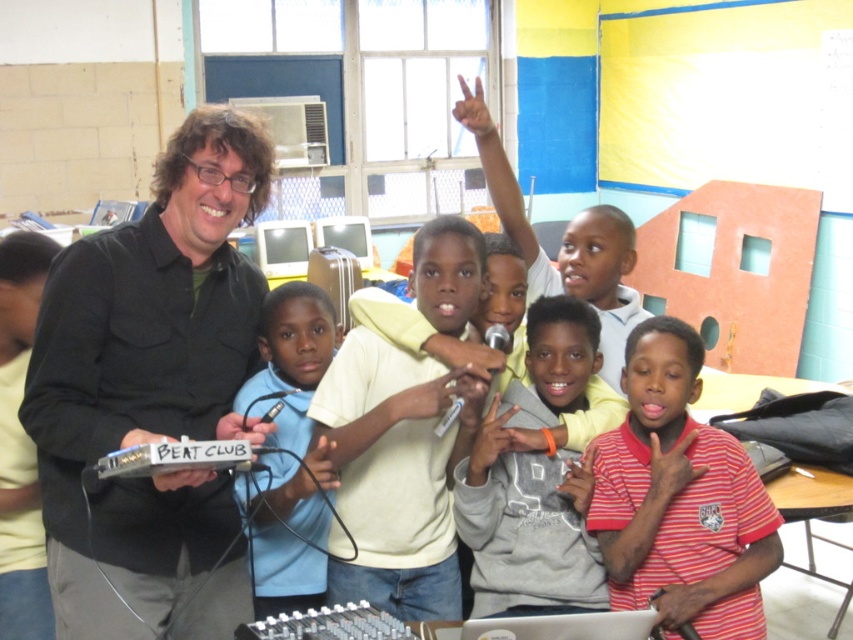
Question: Does striped cotton shirt at center appear over blue fabric shirt at center?

Choices:
 (A) yes
 (B) no

Answer: (B)

Question: Among these points, which one is farthest from the camera?

Choices:
 (A) (302, 579)
 (B) (334, 420)
 (C) (741, 548)
 (D) (160, 516)

Answer: (A)

Question: Which point is closer to the camera taking this photo?

Choices:
 (A) (x=405, y=588)
 (B) (x=157, y=388)
 (C) (x=566, y=394)
 (D) (x=622, y=541)

Answer: (B)

Question: Does striped cotton shirt at center come behind blue fabric shirt at center?

Choices:
 (A) no
 (B) yes

Answer: (B)

Question: Is gray fleece hoodie at center bigger than blue fabric shirt at center?

Choices:
 (A) yes
 (B) no

Answer: (B)

Question: Among these objects, which one is nearest to the camera?

Choices:
 (A) light yellow hoodie at center
 (B) gray fleece hoodie at center
 (C) black matte shirt at center

Answer: (C)